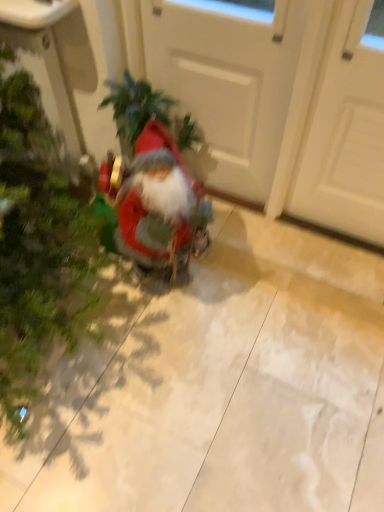
Where is `matte white tile at center`? The width and height of the screenshot is (384, 512). matte white tile at center is located at coordinates (215, 384).

This screenshot has height=512, width=384. What do you see at coordinates (215, 384) in the screenshot?
I see `matte white tile at center` at bounding box center [215, 384].

Locate an element on the screen. matte white tile at center is located at coordinates (215, 384).